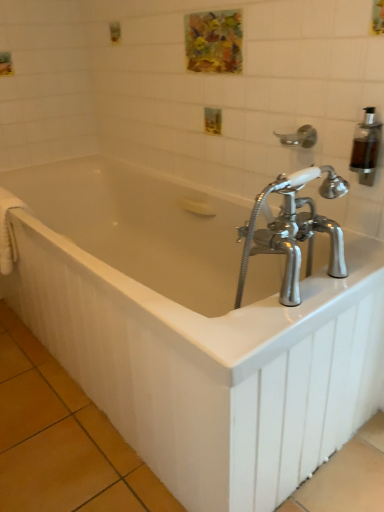
Question: Considering the relative positions of silver metallic shower head at upper right and watercolor painting at upper center in the image provided, is silver metallic shower head at upper right to the left of watercolor painting at upper center from the viewer's perspective?

Choices:
 (A) no
 (B) yes

Answer: (A)

Question: From a real-world perspective, is silver metallic shower head at upper right located higher than watercolor painting at upper center?

Choices:
 (A) yes
 (B) no

Answer: (B)

Question: From the image's perspective, does silver metallic shower head at upper right appear higher than watercolor painting at upper center?

Choices:
 (A) yes
 (B) no

Answer: (B)

Question: From the image's perspective, would you say silver metallic shower head at upper right is shown under watercolor painting at upper center?

Choices:
 (A) yes
 (B) no

Answer: (A)

Question: Is silver metallic shower head at upper right next to watercolor painting at upper center and touching it?

Choices:
 (A) no
 (B) yes

Answer: (A)

Question: Is watercolor painting at upper center wider or thinner than white glossy bathtub at center?

Choices:
 (A) thin
 (B) wide

Answer: (A)

Question: Is watercolor painting at upper center to the left or to the right of white glossy bathtub at center in the image?

Choices:
 (A) left
 (B) right

Answer: (B)

Question: Is point (226, 24) positioned closer to the camera than point (145, 342)?

Choices:
 (A) closer
 (B) farther

Answer: (B)

Question: From a real-world perspective, is watercolor painting at upper center above or below white glossy bathtub at center?

Choices:
 (A) above
 (B) below

Answer: (A)

Question: Visually, is white glossy bathtub at center positioned to the left or to the right of white fabric towel bar at left?

Choices:
 (A) right
 (B) left

Answer: (A)

Question: Choose the correct answer: Is white glossy bathtub at center inside white fabric towel bar at left or outside it?

Choices:
 (A) inside
 (B) outside

Answer: (B)

Question: In terms of width, does white glossy bathtub at center look wider or thinner when compared to white fabric towel bar at left?

Choices:
 (A) thin
 (B) wide

Answer: (B)

Question: From their relative heights in the image, would you say white glossy bathtub at center is taller or shorter than white fabric towel bar at left?

Choices:
 (A) tall
 (B) short

Answer: (A)

Question: From the image's perspective, relative to watercolor painting at upper center, is silver metallic shower head at upper right above or below?

Choices:
 (A) below
 (B) above

Answer: (A)

Question: Looking at the image, does silver metallic shower head at upper right seem bigger or smaller compared to watercolor painting at upper center?

Choices:
 (A) small
 (B) big

Answer: (A)